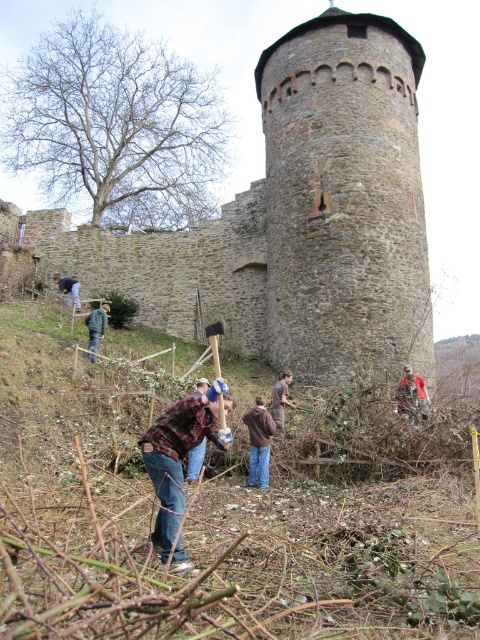
You are standing at the center of the image and want to locate the gray stone tower at center. According to the coordinates provided, in which direction should you look to find it?

The gray stone tower at center is located at coordinates point (344, 198). Since you are at the center, looking towards the lower right direction will lead you to the gray stone tower at center.

You are a visitor at this historic site and want to take a photo of the gray stone tower at center without any people in the frame. Is the plaid flannel shirt at center currently blocking your view of the tower?

The gray stone tower at center is positioned over the plaid flannel shirt at center, meaning the tower is in front of the shirt. Since the tower is in front, it would block the view of the shirt, but the shirt is not blocking the tower. Therefore, the plaid flannel shirt at center is behind the tower and does not obstruct the view of the gray stone tower at center.